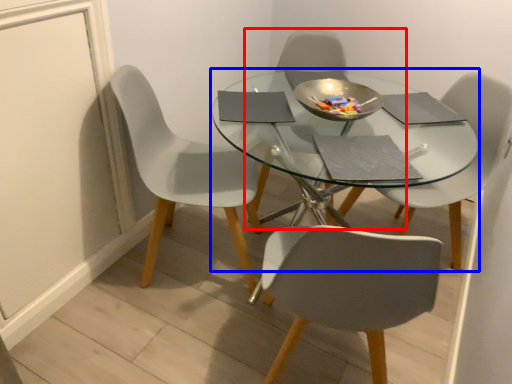
Question: Which object is closer to the camera taking this photo, chair (highlighted by a red box) or round table (highlighted by a blue box)?

Choices:
 (A) chair
 (B) round table

Answer: (B)